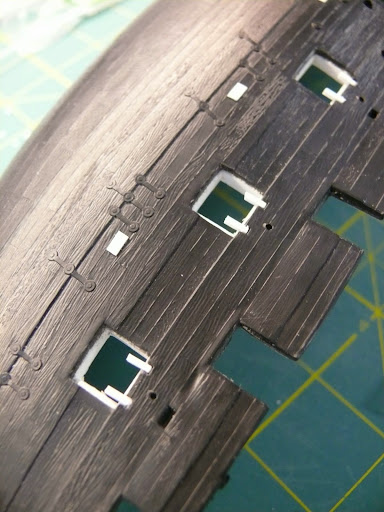
The height and width of the screenshot is (512, 384). What are the coordinates of `windows` in the screenshot? It's located at (107, 358), (231, 202), (315, 80).